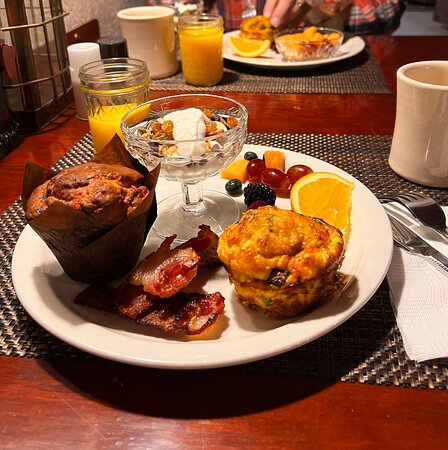
In order to click on glass in this screenshot , I will do `click(191, 207)`.